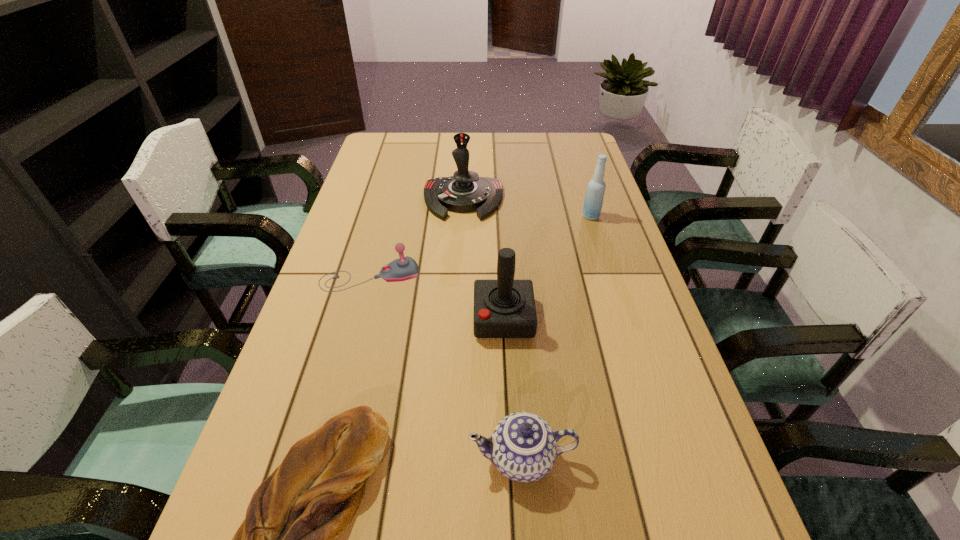
Where is `the farthest joystick`? This screenshot has width=960, height=540. the farthest joystick is located at coordinates click(465, 191).

The height and width of the screenshot is (540, 960). What are the coordinates of `the rightmost object` in the screenshot? It's located at (593, 201).

Identify the location of the nearest joystick. (504, 308).

Where is `chinaware`? The width and height of the screenshot is (960, 540). chinaware is located at coordinates (523, 447).

Where is `the shortest joystick`? The width and height of the screenshot is (960, 540). the shortest joystick is located at coordinates (404, 268).

At what (x,y) coordinates should I click in order to perform the action: click on the second nearest joystick. Please return your answer as a coordinate pair (x, y). The width and height of the screenshot is (960, 540). Looking at the image, I should click on (404, 268).

In order to click on blank area located 0.050m on the handle side of the farthest joystick in this screenshot , I will do `click(462, 231)`.

I want to click on vacant space located 0.100m on the left of the bottle, so click(551, 216).

Find the location of a particular element. vacant space located on the base of the nearest joystick is located at coordinates (430, 318).

Find the location of a particular element. This screenshot has height=540, width=960. vacant region located 0.260m on the base of the nearest joystick is located at coordinates click(370, 318).